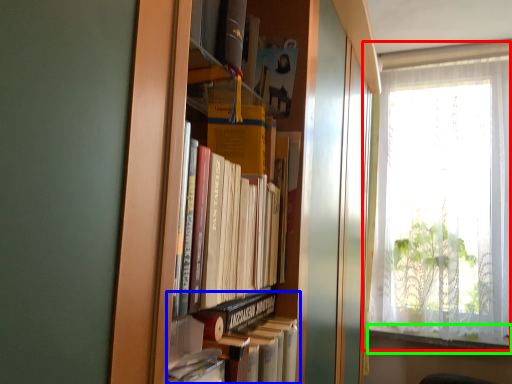
Question: Based on their relative distances, which object is farther from window (highlighted by a red box)? Choose from book (highlighted by a blue box) and window sill (highlighted by a green box).

Choices:
 (A) book
 (B) window sill

Answer: (A)